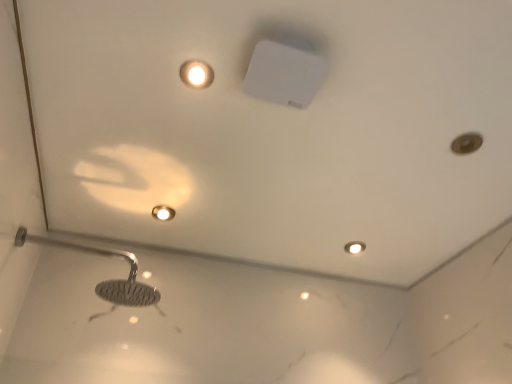
This screenshot has height=384, width=512. What are the coordinates of `polished chrome shower head at lower left` in the screenshot? It's located at (106, 280).

In the scene shown: Who is taller, matte white light fixture at bottom right or polished chrome shower head at lower left?

polished chrome shower head at lower left is taller.

Is matte white light fixture at bottom right positioned with its back to polished chrome shower head at lower left?

No, matte white light fixture at bottom right's orientation is not away from polished chrome shower head at lower left.

From the image's perspective, is matte white light fixture at bottom right positioned above or below polished chrome shower head at lower left?

Clearly, from the image's perspective, matte white light fixture at bottom right is below polished chrome shower head at lower left.

Is matte white light fixture at bottom right bigger or smaller than polished chrome shower head at lower left?

matte white light fixture at bottom right is smaller than polished chrome shower head at lower left.

Is point (117, 282) more distant than point (350, 244)?

No, it is not.

Is polished chrome shower head at lower left directly adjacent to matte white light fixture at bottom right?

No, polished chrome shower head at lower left is not in contact with matte white light fixture at bottom right.

Considering their positions, is polished chrome shower head at lower left located in front of or behind matte white light fixture at bottom right?

polished chrome shower head at lower left is positioned closer to the viewer than matte white light fixture at bottom right.

Would you say polished chrome shower head at lower left is inside or outside matte white light fixture at bottom right?

polished chrome shower head at lower left is spatially situated outside matte white light fixture at bottom right.

Can you confirm if matte white light fixture at bottom right is taller than matte gold droplight at upper center?

No.

Can you confirm if matte white light fixture at bottom right is positioned to the right of matte gold droplight at upper center?

Correct, you'll find matte white light fixture at bottom right to the right of matte gold droplight at upper center.

Which is in front, matte white light fixture at bottom right or matte gold droplight at upper center?

matte gold droplight at upper center.

Is matte white light fixture at bottom right touching matte gold droplight at upper center?

No, matte white light fixture at bottom right is not with matte gold droplight at upper center.

Measure the distance from matte gold droplight at upper center to polished chrome shower head at lower left.

They are 13.31 inches apart.

Which of these two, matte gold droplight at upper center or polished chrome shower head at lower left, is wider?

polished chrome shower head at lower left is wider.

Is matte gold droplight at upper center touching polished chrome shower head at lower left?

No.

What's the angular difference between matte gold droplight at upper center and polished chrome shower head at lower left's facing directions?

There is a 93.8-degree angle between the facing directions of matte gold droplight at upper center and polished chrome shower head at lower left.

Which is in front, point (164, 211) or point (346, 244)?

The point (164, 211) is closer.

What are the coordinates of `light fixture that appears behind the matte gold droplight at upper center` in the screenshot? It's located at (354, 247).

Does matte gold droplight at upper center contain matte white light fixture at bottom right?

No, matte white light fixture at bottom right is not surrounded by matte gold droplight at upper center.

Does matte gold droplight at upper center have a greater width compared to matte white light fixture at bottom right?

Yes.

In the image, there is a matte gold droplight at upper center. At what (x,y) coordinates should I click in order to perform the action: click on shower below it (from a real-world perspective). Please return your answer as a coordinate pair (x, y). The image size is (512, 384). Looking at the image, I should click on (106, 280).

Considering the positions of objects polished chrome shower head at lower left and matte gold droplight at upper center in the image provided, who is in front, polished chrome shower head at lower left or matte gold droplight at upper center?

polished chrome shower head at lower left is more forward.

Is polished chrome shower head at lower left to the right of matte gold droplight at upper center from the viewer's perspective?

Incorrect, polished chrome shower head at lower left is not on the right side of matte gold droplight at upper center.

From the image's perspective, who appears lower, polished chrome shower head at lower left or matte gold droplight at upper center?

polished chrome shower head at lower left appears lower in the image.

The height and width of the screenshot is (384, 512). What are the coordinates of `shower that is above the matte white light fixture at bottom right (from the image's perspective)` in the screenshot? It's located at (106, 280).

You are a GUI agent. You are given a task and a screenshot of the screen. Output one action in this format:
    pyautogui.click(x=<x>, y=<y>)
    Task: Click on the light fixture behind the polished chrome shower head at lower left
    This screenshot has width=512, height=384.
    Given the screenshot: What is the action you would take?
    tap(354, 247)

From the image, which object appears to be farther from matte white light fixture at bottom right, polished chrome shower head at lower left or matte gold droplight at upper center?

polished chrome shower head at lower left is positioned further to the anchor matte white light fixture at bottom right.

Estimate the real-world distances between objects in this image. Which object is closer to matte gold droplight at upper center, polished chrome shower head at lower left or matte white light fixture at bottom right?

polished chrome shower head at lower left.

Based on their spatial positions, is matte gold droplight at upper center or polished chrome shower head at lower left closer to matte white light fixture at bottom right?

matte gold droplight at upper center is positioned closer to the anchor matte white light fixture at bottom right.

Which object lies further to the anchor point polished chrome shower head at lower left, matte gold droplight at upper center or matte white light fixture at bottom right?

matte white light fixture at bottom right is further to polished chrome shower head at lower left.

Looking at the image, which one is located further to matte gold droplight at upper center, matte white light fixture at bottom right or polished chrome shower head at lower left?

matte white light fixture at bottom right is positioned further to the anchor matte gold droplight at upper center.

Considering their positions, is matte white light fixture at bottom right positioned further to polished chrome shower head at lower left than matte gold droplight at upper center?

matte white light fixture at bottom right lies further to polished chrome shower head at lower left than the other object.

At what (x,y) coordinates should I click in order to perform the action: click on droplight between polished chrome shower head at lower left and matte white light fixture at bottom right from left to right. Please return your answer as a coordinate pair (x, y). This screenshot has width=512, height=384. Looking at the image, I should click on (163, 213).